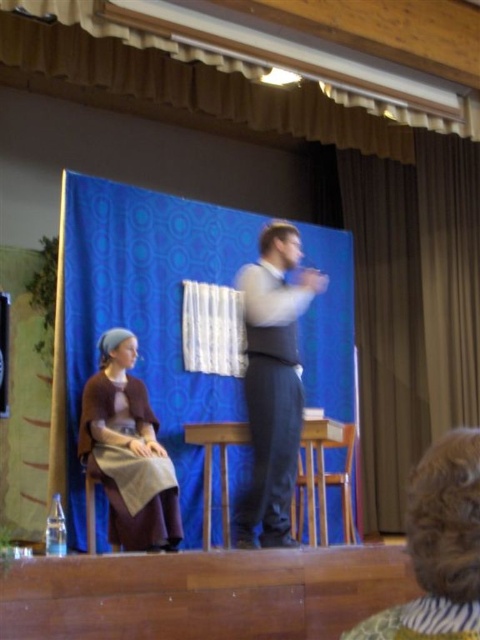
Question: Which point is farther from the camera taking this photo?

Choices:
 (A) (375, 637)
 (B) (340, 440)
 (C) (245, 513)
 (D) (0, 339)

Answer: (B)

Question: Does light gray fabric vest at center appear on the left side of matte brown dress at left?

Choices:
 (A) yes
 (B) no

Answer: (B)

Question: Does light gray fabric vest at center lie in front of matte black vest at center?

Choices:
 (A) no
 (B) yes

Answer: (A)

Question: Which object appears closest to the camera in this image?

Choices:
 (A) matte black vest at center
 (B) light gray fabric vest at center
 (C) wooden stool at center

Answer: (A)

Question: Does light gray fabric vest at center come behind wooden stool at center?

Choices:
 (A) no
 (B) yes

Answer: (A)

Question: Which object is farther from the camera taking this photo?

Choices:
 (A) matte black vest at center
 (B) wooden stool at center
 (C) matte brown dress at left

Answer: (B)